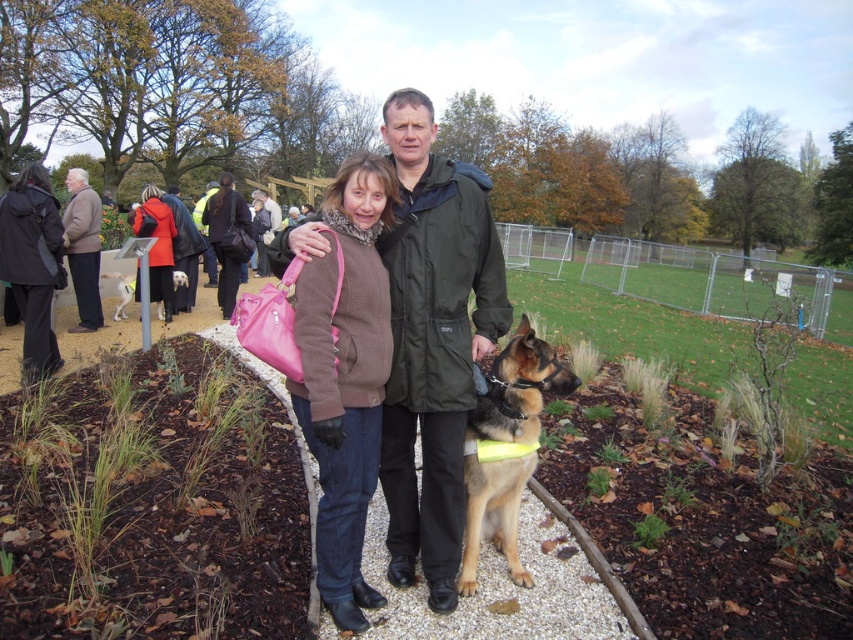
Question: Which is farther from the dark gray wool coat at left?

Choices:
 (A) brown fuzzy sweater at center
 (B) light brown wool coat at left

Answer: (A)

Question: Which point appears farthest from the camera in this image?

Choices:
 (A) (109, 276)
 (B) (387, 141)

Answer: (A)

Question: Does brown fur dog at center appear under light brown wool coat at left?

Choices:
 (A) no
 (B) yes

Answer: (B)

Question: Does matte pink handbag at center appear on the left side of matte black jacket at center?

Choices:
 (A) no
 (B) yes

Answer: (B)

Question: Which of the following is the farthest from the observer?

Choices:
 (A) white fur dog at left
 (B) brown fuzzy sweater at center
 (C) dark gray wool coat at left
 (D) light brown wool coat at left

Answer: (A)

Question: Does brown fur dog at center appear on the right side of dark gray wool coat at left?

Choices:
 (A) no
 (B) yes

Answer: (B)